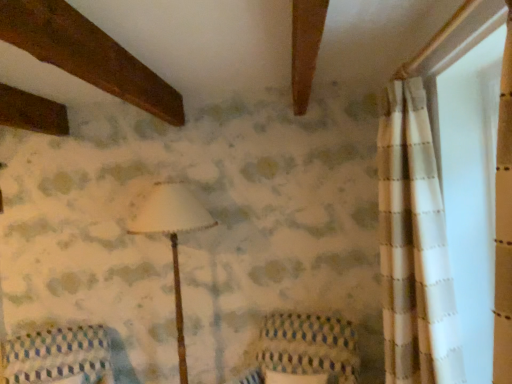
Question: From the image's perspective, does patterned fabric cushion at lower left appear lower than knitted fabric armchair at center?

Choices:
 (A) no
 (B) yes

Answer: (B)

Question: Can you confirm if patterned fabric cushion at lower left is bigger than knitted fabric armchair at center?

Choices:
 (A) no
 (B) yes

Answer: (B)

Question: From the image's perspective, would you say patterned fabric cushion at lower left is positioned over knitted fabric armchair at center?

Choices:
 (A) yes
 (B) no

Answer: (B)

Question: Considering the relative sizes of patterned fabric cushion at lower left and knitted fabric armchair at center in the image provided, is patterned fabric cushion at lower left thinner than knitted fabric armchair at center?

Choices:
 (A) no
 (B) yes

Answer: (A)

Question: Is patterned fabric cushion at lower left facing towards knitted fabric armchair at center?

Choices:
 (A) no
 (B) yes

Answer: (A)

Question: Does patterned fabric cushion at lower left come in front of knitted fabric armchair at center?

Choices:
 (A) yes
 (B) no

Answer: (B)

Question: Does knitted fabric armchair at center touch patterned fabric cushion at lower left?

Choices:
 (A) yes
 (B) no

Answer: (B)

Question: Is knitted fabric armchair at center further to camera compared to patterned fabric cushion at lower left?

Choices:
 (A) yes
 (B) no

Answer: (B)

Question: Considering the relative sizes of knitted fabric armchair at center and patterned fabric cushion at lower left in the image provided, is knitted fabric armchair at center thinner than patterned fabric cushion at lower left?

Choices:
 (A) no
 (B) yes

Answer: (B)

Question: Does knitted fabric armchair at center have a smaller size compared to patterned fabric cushion at lower left?

Choices:
 (A) no
 (B) yes

Answer: (B)

Question: From the image's perspective, would you say knitted fabric armchair at center is positioned over patterned fabric cushion at lower left?

Choices:
 (A) yes
 (B) no

Answer: (A)

Question: Can you confirm if knitted fabric armchair at center is positioned to the left of patterned fabric cushion at lower left?

Choices:
 (A) yes
 (B) no

Answer: (B)

Question: Can you confirm if patterned fabric cushion at lower left is smaller than white matte lampshade at center?

Choices:
 (A) yes
 (B) no

Answer: (A)